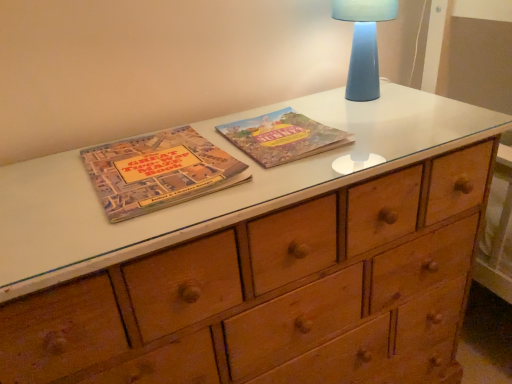
Question: Is blue ceramic lamp at upper right to the left of matte cardboard book at center-left, the second paperback book viewed from the right, from the viewer's perspective?

Choices:
 (A) yes
 (B) no

Answer: (B)

Question: Is matte cardboard book at center-left, placed as the 1th paperback book when sorted from left to right, a part of blue ceramic lamp at upper right?

Choices:
 (A) no
 (B) yes

Answer: (A)

Question: Considering the relative sizes of blue ceramic lamp at upper right and matte cardboard book at center-left, the second paperback book viewed from the right, in the image provided, is blue ceramic lamp at upper right bigger than matte cardboard book at center-left, the second paperback book viewed from the right,?

Choices:
 (A) yes
 (B) no

Answer: (A)

Question: Is blue ceramic lamp at upper right aimed at matte cardboard book at center-left, the second paperback book viewed from the right?

Choices:
 (A) yes
 (B) no

Answer: (B)

Question: Can we say blue ceramic lamp at upper right lies outside matte cardboard book at center-left, placed as the 1th paperback book when sorted from left to right?

Choices:
 (A) yes
 (B) no

Answer: (A)

Question: Considering the positions of matte paper book at center, the first paperback book from the right, and blue ceramic lamp at upper right in the image, is matte paper book at center, the first paperback book from the right, wider or thinner than blue ceramic lamp at upper right?

Choices:
 (A) thin
 (B) wide

Answer: (B)

Question: Is point [x=315, y=124] positioned closer to the camera than point [x=376, y=4]?

Choices:
 (A) closer
 (B) farther

Answer: (B)

Question: Looking at the image, does matte paper book at center, which appears as the 2th paperback book when viewed from the left, seem bigger or smaller compared to blue ceramic lamp at upper right?

Choices:
 (A) big
 (B) small

Answer: (B)

Question: From the image's perspective, is matte paper book at center, which appears as the 2th paperback book when viewed from the left, above or below blue ceramic lamp at upper right?

Choices:
 (A) below
 (B) above

Answer: (A)

Question: From the image's perspective, is matte cardboard book at center-left, the second paperback book viewed from the right, above or below blue ceramic lamp at upper right?

Choices:
 (A) above
 (B) below

Answer: (B)

Question: Is matte cardboard book at center-left, the second paperback book viewed from the right, inside or outside of blue ceramic lamp at upper right?

Choices:
 (A) outside
 (B) inside

Answer: (A)

Question: From a real-world perspective, is matte cardboard book at center-left, placed as the 1th paperback book when sorted from left to right, positioned above or below blue ceramic lamp at upper right?

Choices:
 (A) above
 (B) below

Answer: (B)

Question: Considering the relative positions of matte cardboard book at center-left, placed as the 1th paperback book when sorted from left to right, and blue ceramic lamp at upper right in the image provided, is matte cardboard book at center-left, placed as the 1th paperback book when sorted from left to right, to the left or to the right of blue ceramic lamp at upper right?

Choices:
 (A) left
 (B) right

Answer: (A)

Question: Would you say blue ceramic lamp at upper right is to the left or to the right of matte cardboard book at center-left, placed as the 1th paperback book when sorted from left to right, in the picture?

Choices:
 (A) left
 (B) right

Answer: (B)

Question: Considering the positions of blue ceramic lamp at upper right and matte cardboard book at center-left, the second paperback book viewed from the right, in the image, is blue ceramic lamp at upper right bigger or smaller than matte cardboard book at center-left, the second paperback book viewed from the right,?

Choices:
 (A) big
 (B) small

Answer: (A)